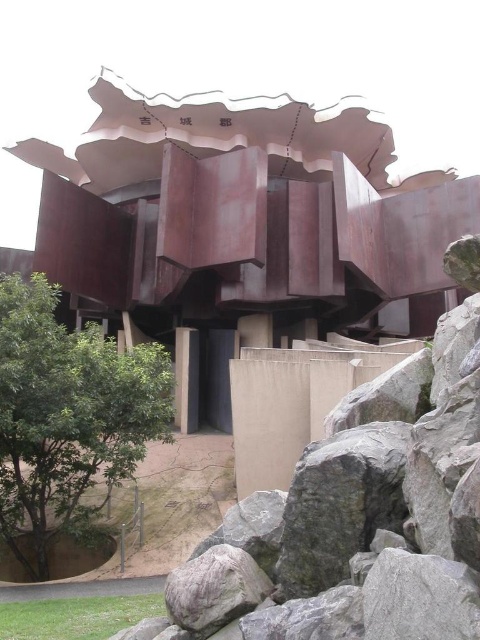
Does rusty metal structure at center appear over green leafy tree at lower left?

Yes, rusty metal structure at center is above green leafy tree at lower left.

Can you confirm if rusty metal structure at center is positioned below green leafy tree at lower left?

No, rusty metal structure at center is not below green leafy tree at lower left.

Between point (453, 212) and point (112, 436), which one is positioned behind?

Positioned behind is point (453, 212).

The image size is (480, 640). I want to click on rusty metal structure at center, so click(239, 214).